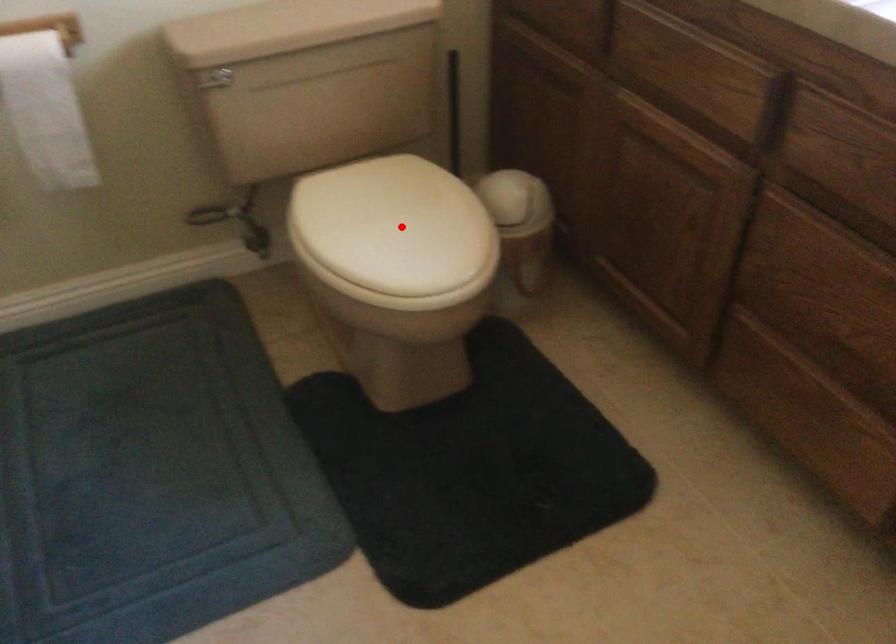
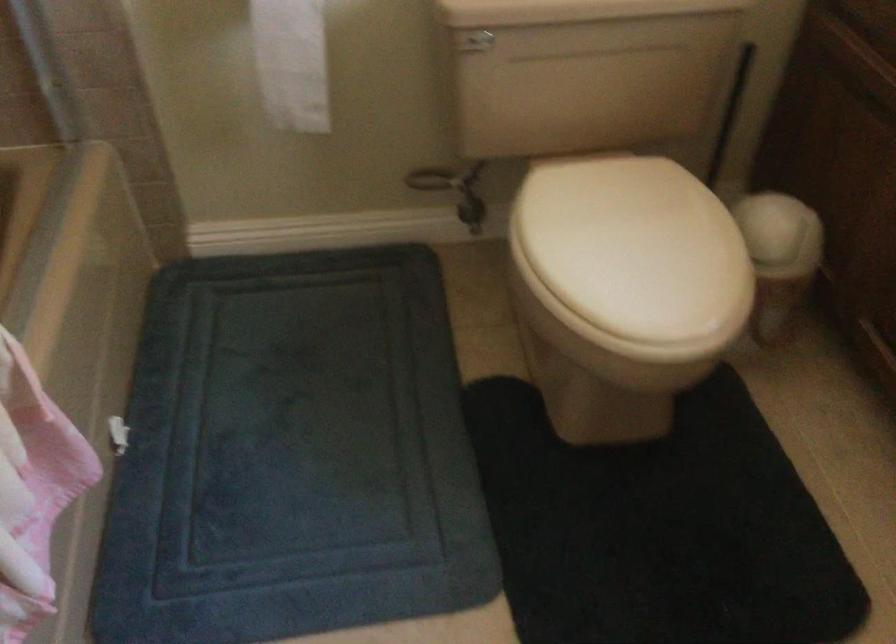
Question: I am providing you with two images of the same scene from different viewpoints. In image1, a red point is highlighted. Considering the same 3D point in image2, which of the following is correct?

Choices:
 (A) It is closer
 (B) It is farther

Answer: (A)